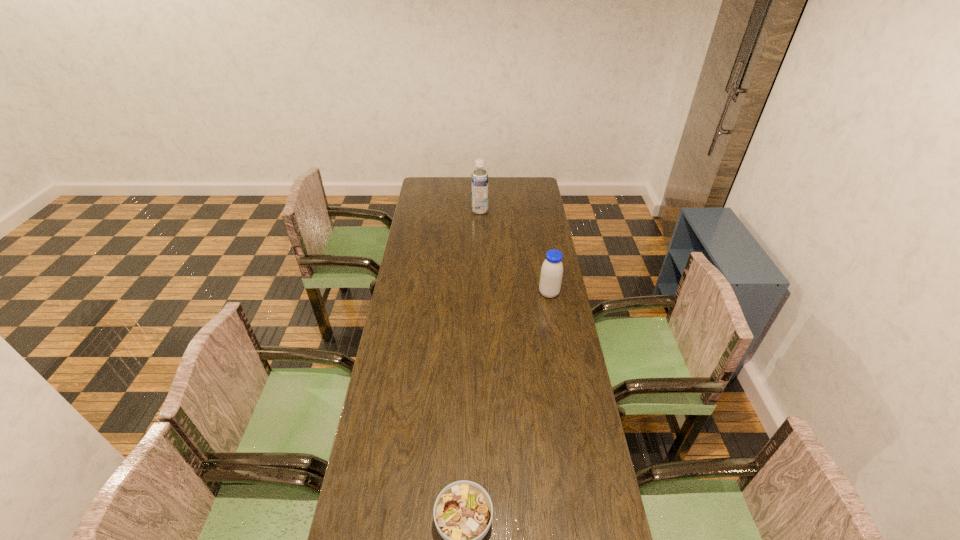
Identify the location of free space that satisfies the following two spatial constraints: 1. on the label of the taller soya milk; 2. on the right side of the rightmost object. This screenshot has width=960, height=540. (480, 293).

Image resolution: width=960 pixels, height=540 pixels. I want to click on vacant space that satisfies the following two spatial constraints: 1. on the label of the nearer soya milk; 2. on the left side of the tallest object, so click(x=480, y=293).

The image size is (960, 540). In order to click on vacant position in the image that satisfies the following two spatial constraints: 1. on the label of the second farthest object; 2. on the right side of the left soya milk in this screenshot , I will do `click(480, 293)`.